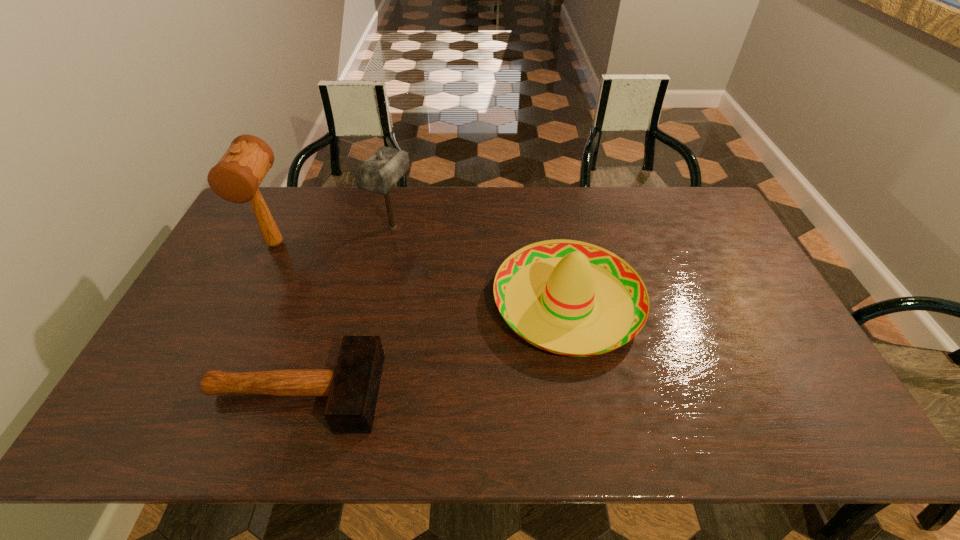
Locate an element on the screen. sombrero is located at coordinates (572, 298).

Find the location of a particular element. This screenshot has width=960, height=540. the second shortest object is located at coordinates (572, 298).

Find the location of `the shortest object`. the shortest object is located at coordinates (352, 387).

Locate an element on the screen. This screenshot has width=960, height=540. the nearest mallet is located at coordinates (352, 387).

I want to click on vacant position located on the left of the rightmost object, so click(468, 303).

I want to click on vacant region located on the hammer head face of the nearest mallet, so click(x=467, y=393).

I want to click on object that is at the near edge, so click(x=352, y=387).

Locate an element on the screen. This screenshot has height=540, width=960. object present at the left edge is located at coordinates (236, 177).

Find the location of a particular element. object at the far left corner is located at coordinates (236, 177).

The height and width of the screenshot is (540, 960). Find the location of `blank space at the far edge of the desktop`. blank space at the far edge of the desktop is located at coordinates (300, 200).